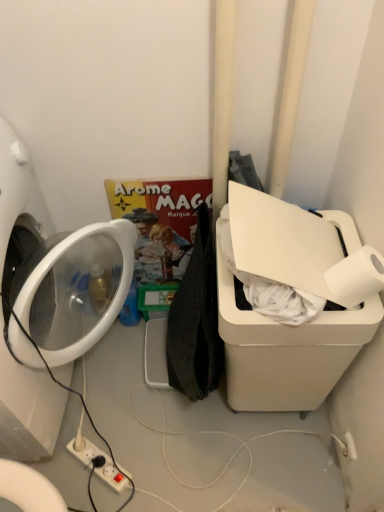
In order to face white matte toilet paper at upper right, should I rotate leftwards or rightwards?

You should rotate right by 21.340 degrees.

The width and height of the screenshot is (384, 512). What do you see at coordinates (74, 297) in the screenshot?
I see `white glossy washing machine at left` at bounding box center [74, 297].

You are a GUI agent. You are given a task and a screenshot of the screen. Output one action in this format:
    pyautogui.click(x=<x>, y=<y>)
    Task: Click on the white plastic water cooler at right
    
    Given the screenshot: What is the action you would take?
    pyautogui.click(x=286, y=349)

What is the approximate width of white plastic water cooler at right?

The width of white plastic water cooler at right is 31.65 centimeters.

Locate an element on the screen. This screenshot has width=384, height=512. white matte toilet paper at upper right is located at coordinates (356, 277).

From the image's perspective, which is above, white glossy washing machine at left or matte cardboard comic book at center?

matte cardboard comic book at center appears higher in the image.

From a real-world perspective, is white glossy washing machine at left physically below matte cardboard comic book at center?

Actually, white glossy washing machine at left is physically above matte cardboard comic book at center in the real world.

Is white glossy washing machine at left spatially inside matte cardboard comic book at center, or outside of it?

white glossy washing machine at left is not inside matte cardboard comic book at center, it's outside.

How much distance is there between white glossy washing machine at left and matte cardboard comic book at center?

10.50 inches.

Find the location of `electric outlet behind the white matte toilet paper at upper right`. electric outlet behind the white matte toilet paper at upper right is located at coordinates [99, 463].

Consider the image. Is white plastic power strip at lower center looking in the opposite direction of white matte toilet paper at upper right?

No.

From a real-world perspective, between white plastic power strip at lower center and white matte toilet paper at upper right, who is vertically higher?

white matte toilet paper at upper right is physically above.

Based on the photo, can you tell me how much white plastic power strip at lower center and white matte toilet paper at upper right differ in facing direction?

There is a 144-degree angle between the facing directions of white plastic power strip at lower center and white matte toilet paper at upper right.

Is point (74, 444) in front of point (275, 410)?

No, (74, 444) is behind (275, 410).

Is white plastic power strip at lower center directly adjacent to white plastic water cooler at right?

No, white plastic power strip at lower center is not with white plastic water cooler at right.

Is white plastic power strip at lower center thinner than white plastic water cooler at right?

Correct, the width of white plastic power strip at lower center is less than that of white plastic water cooler at right.

From a real-world perspective, who is located higher, white plastic power strip at lower center or white plastic water cooler at right?

white plastic water cooler at right, from a real-world perspective.

Measure the distance between matte cardboard comic book at center and white plastic water cooler at right.

matte cardboard comic book at center is 17.27 inches from white plastic water cooler at right.

Which of these two, matte cardboard comic book at center or white plastic water cooler at right, is bigger?

white plastic water cooler at right is bigger.

At what (x,y) coordinates should I click in order to perform the action: click on water cooler that is above the matte cardboard comic book at center (from a real-world perspective). Please return your answer as a coordinate pair (x, y). This screenshot has height=512, width=384. Looking at the image, I should click on (286, 349).

Is matte cardboard comic book at center aimed at white plastic water cooler at right?

No, matte cardboard comic book at center is not turned towards white plastic water cooler at right.

What's the angular difference between white plastic water cooler at right and white plastic power strip at lower center's facing directions?

The facing directions of white plastic water cooler at right and white plastic power strip at lower center are 144 degrees apart.

From the image's perspective, between white plastic water cooler at right and white plastic power strip at lower center, which one is located above?

white plastic water cooler at right, from the image's perspective.

Does white plastic water cooler at right have a lesser height compared to white plastic power strip at lower center?

Incorrect, the height of white plastic water cooler at right does not fall short of that of white plastic power strip at lower center.

In the image, is white glossy washing machine at left positioned in front of or behind white plastic water cooler at right?

Clearly, white glossy washing machine at left is in front of white plastic water cooler at right.

Which is more to the right, white glossy washing machine at left or white plastic water cooler at right?

From the viewer's perspective, white plastic water cooler at right appears more on the right side.

Could you tell me if white glossy washing machine at left is turned towards white plastic water cooler at right?

Yes, white glossy washing machine at left is aimed at white plastic water cooler at right.

Is white glossy washing machine at left positioned beyond the bounds of white plastic water cooler at right?

Indeed, white glossy washing machine at left is completely outside white plastic water cooler at right.

Considering the relative positions of matte cardboard comic book at center and white matte toilet paper at upper right in the image provided, is matte cardboard comic book at center to the left or to the right of white matte toilet paper at upper right?

matte cardboard comic book at center is to the left of white matte toilet paper at upper right.

Is point (190, 213) more distant than point (378, 284)?

Yes, it is.

Considering the sizes of matte cardboard comic book at center and white matte toilet paper at upper right in the image, is matte cardboard comic book at center bigger or smaller than white matte toilet paper at upper right?

Considering their sizes, matte cardboard comic book at center takes up more space than white matte toilet paper at upper right.

Consider the image. Is matte cardboard comic book at center positioned far away from white matte toilet paper at upper right?

No, there isn't a large distance between matte cardboard comic book at center and white matte toilet paper at upper right.

I want to click on washing machine in front of the matte cardboard comic book at center, so click(x=74, y=297).

This screenshot has width=384, height=512. I want to click on electric outlet that appears on the left of white matte toilet paper at upper right, so click(99, 463).

Considering their positions, is matte cardboard comic book at center positioned further to white plastic power strip at lower center than white matte toilet paper at upper right?

white matte toilet paper at upper right is positioned further to the anchor white plastic power strip at lower center.

Which object lies nearer to the anchor point white glossy washing machine at left, matte cardboard comic book at center or white matte toilet paper at upper right?

Based on the image, matte cardboard comic book at center appears to be nearer to white glossy washing machine at left.

Which object lies nearer to the anchor point white plastic power strip at lower center, matte cardboard comic book at center or white plastic water cooler at right?

white plastic water cooler at right is closer to white plastic power strip at lower center.

Estimate the real-world distances between objects in this image. Which object is closer to white matte toilet paper at upper right, matte cardboard comic book at center or white plastic power strip at lower center?

matte cardboard comic book at center is positioned closer to the anchor white matte toilet paper at upper right.

Looking at the image, which one is located further to white plastic water cooler at right, matte cardboard comic book at center or white plastic power strip at lower center?

Among the two, white plastic power strip at lower center is located further to white plastic water cooler at right.

Estimate the real-world distances between objects in this image. Which object is closer to white plastic power strip at lower center, white glossy washing machine at left or white matte toilet paper at upper right?

The object closer to white plastic power strip at lower center is white glossy washing machine at left.

When comparing their distances from white glossy washing machine at left, does matte cardboard comic book at center or white plastic power strip at lower center seem closer?

matte cardboard comic book at center is closer to white glossy washing machine at left.

Considering their positions, is white plastic water cooler at right positioned further to white matte toilet paper at upper right than white plastic power strip at lower center?

white plastic power strip at lower center is further to white matte toilet paper at upper right.

Find the location of a particular element. The image size is (384, 512). toilet paper between matte cardboard comic book at center and white plastic power strip at lower center in the up-down direction is located at coordinates (356, 277).

Locate an element on the screen. The height and width of the screenshot is (512, 384). washing machine between matte cardboard comic book at center and white plastic power strip at lower center vertically is located at coordinates (74, 297).

Where is `water cooler between matte cardboard comic book at center and white plastic power strip at lower center from top to bottom`? water cooler between matte cardboard comic book at center and white plastic power strip at lower center from top to bottom is located at coordinates (286, 349).

I want to click on comic book between white glossy washing machine at left and white matte toilet paper at upper right from left to right, so click(x=160, y=223).